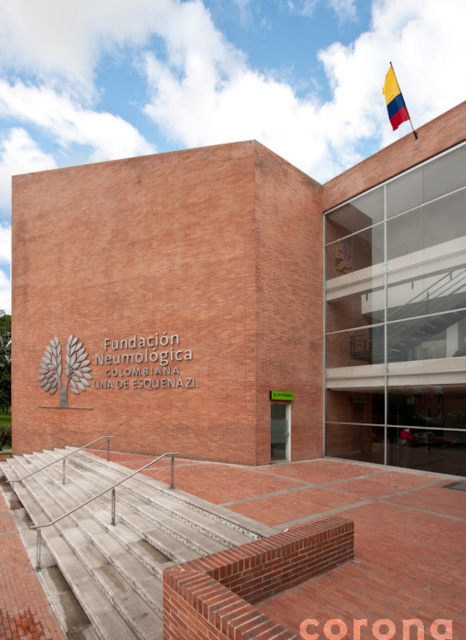
You are a delivery person standing at the concrete steps at lower left, and you need to deliver a package to the red fabric flag at upper right. The delivery robot you are using has a maximum operating range of 50 feet. Can the robot reach the flag from your current position?

The distance between the concrete steps at lower left and the red fabric flag at upper right is 51.39 feet, which exceeds the robot s 50 feet range. Therefore, the robot cannot reach the flag from the current position.

You are standing in front of the Fundacion Neumologica Colombiana Lina de Esquenazi building. You see the concrete steps at lower left and the red fabric flag at upper right. Which object is positioned to the left of the other?

The concrete steps at lower left is to the left of red fabric flag at upper right.